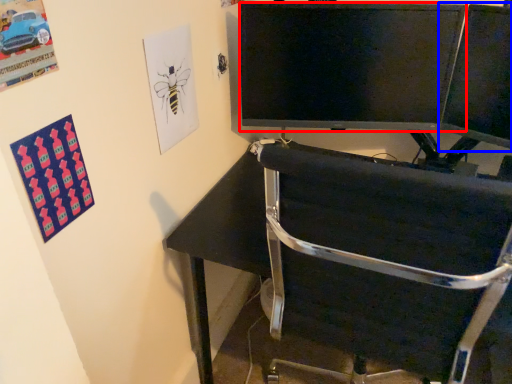
Question: Which of the following is the farthest to the observer, television (highlighted by a red box) or computer monitor (highlighted by a blue box)?

Choices:
 (A) television
 (B) computer monitor

Answer: (A)